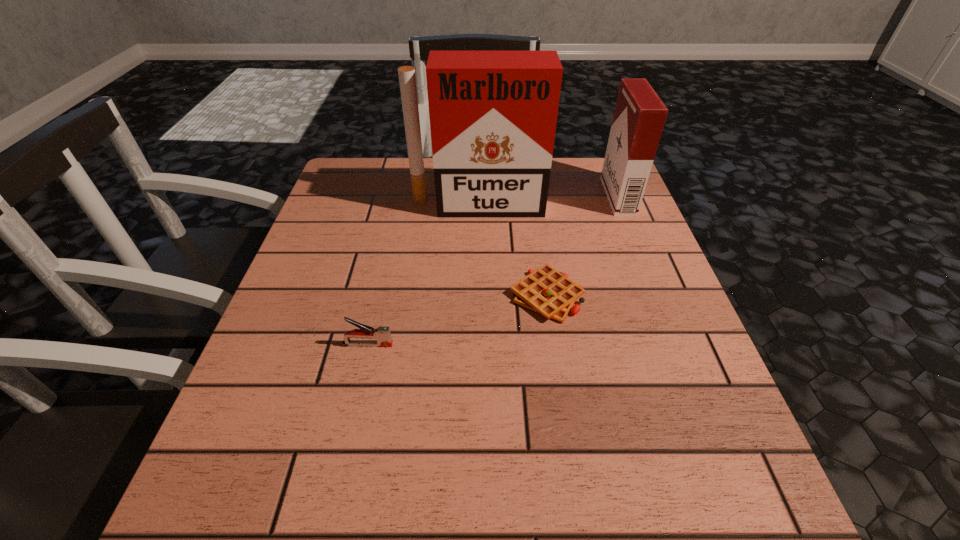
At what (x,y) coordinates should I click in order to perform the action: click on vacant space at the far left corner of the desktop. Please return your answer as a coordinate pair (x, y). Looking at the image, I should click on (342, 206).

This screenshot has height=540, width=960. In the image, there is a desktop. Find the location of `free region at the near left corner`. free region at the near left corner is located at coordinates (226, 496).

I want to click on vacant space at the far right corner, so click(x=574, y=187).

Where is `vacant area at the near right corner`? The image size is (960, 540). vacant area at the near right corner is located at coordinates 657,539.

The height and width of the screenshot is (540, 960). What are the coordinates of `unoccupied position between the rightmost object and the waffle` in the screenshot? It's located at (583, 246).

The height and width of the screenshot is (540, 960). Identify the location of free point between the shortest object and the tallest object. (513, 250).

The width and height of the screenshot is (960, 540). In order to click on free spot between the left cigarette_case and the third tallest object in this screenshot , I will do `click(422, 275)`.

What are the coordinates of `free spot between the waffle and the shorter cigarette_case` in the screenshot? It's located at [583, 246].

Identify the location of unoccupied area between the taller cigarette_case and the waffle. (513, 250).

Where is `empty space between the waffle and the stapler`? The height and width of the screenshot is (540, 960). empty space between the waffle and the stapler is located at coordinates (457, 320).